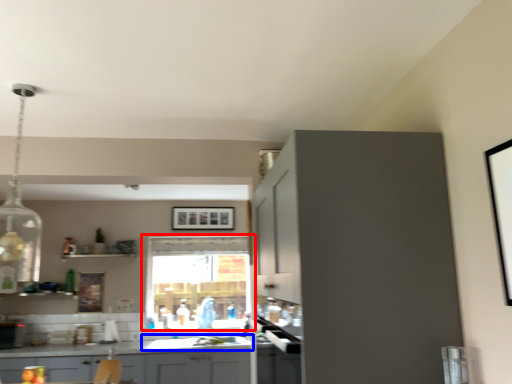
Question: Which object is closer to the camera taking this photo, window (highlighted by a red box) or sink (highlighted by a blue box)?

Choices:
 (A) window
 (B) sink

Answer: (B)